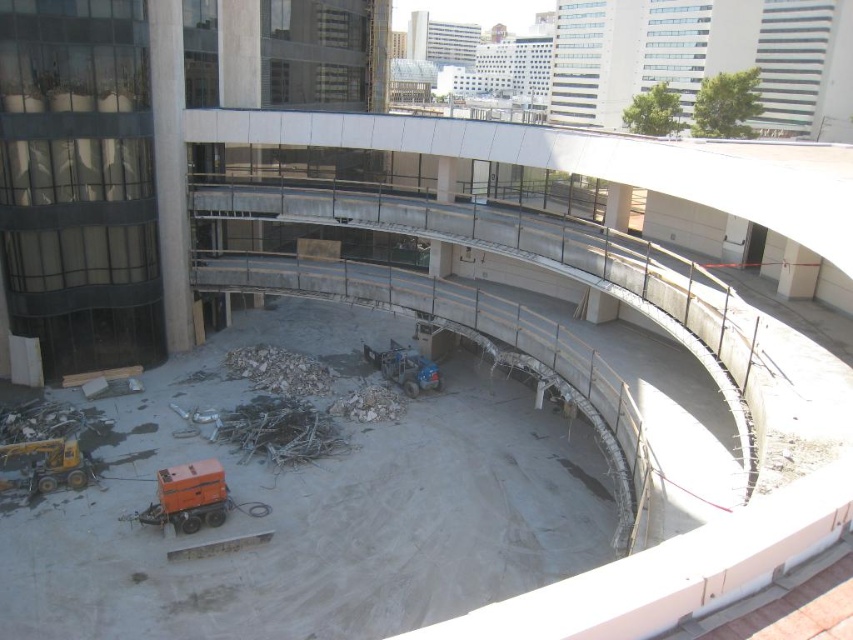
Between yellow metallic excavator at lower left and gray concrete debris at center, which one is positioned lower?

yellow metallic excavator at lower left is below.

This screenshot has height=640, width=853. Find the location of `yellow metallic excavator at lower left`. yellow metallic excavator at lower left is located at coordinates (47, 465).

Does orange rubberized machine at center appear under blue metallic forklift at center?

Yes.

Can you confirm if orange rubberized machine at center is thinner than blue metallic forklift at center?

Yes.

Identify the location of orange rubberized machine at center. This screenshot has height=640, width=853. (189, 497).

This screenshot has height=640, width=853. Find the location of `orange rubberized machine at center`. orange rubberized machine at center is located at coordinates (189, 497).

Who is lower down, yellow metallic excavator at lower left or blue metallic forklift at center?

Positioned lower is yellow metallic excavator at lower left.

Which is more to the right, yellow metallic excavator at lower left or blue metallic forklift at center?

From the viewer's perspective, blue metallic forklift at center appears more on the right side.

Between point (51, 458) and point (370, 364), which one is positioned behind?

Positioned behind is point (370, 364).

Find the location of `yellow metallic excavator at lower left`. yellow metallic excavator at lower left is located at coordinates (47, 465).